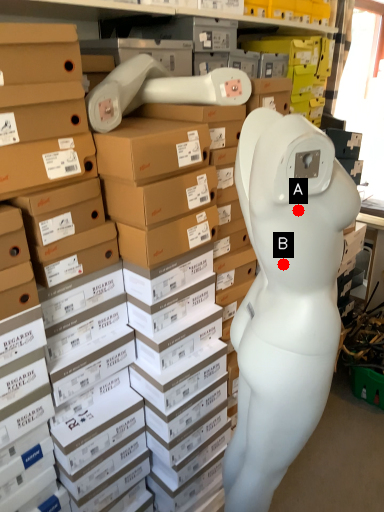
Question: Two points are circled on the image, labeled by A and B beside each circle. Which of the following is the farthest from the observer?

Choices:
 (A) A is further
 (B) B is further

Answer: (B)